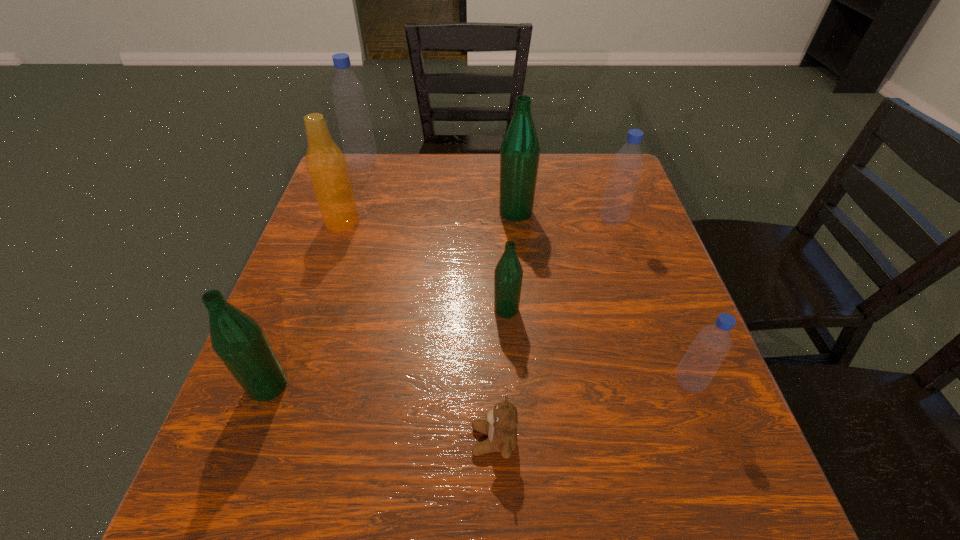
Where is `the nearest object`? the nearest object is located at coordinates (501, 425).

The width and height of the screenshot is (960, 540). What are the coordinates of `the shortest object` in the screenshot? It's located at (501, 425).

The image size is (960, 540). In order to click on vacant region located 0.230m on the front of the biggest blue bottle in this screenshot , I will do `click(343, 221)`.

At what (x,y) coordinates should I click in order to perform the action: click on free space located on the left of the biggest green bottle. Please return your answer as a coordinate pair (x, y). Looking at the image, I should click on (474, 212).

The image size is (960, 540). I want to click on vacant space located 0.310m on the right of the beer bottle, so click(x=484, y=222).

Identify the location of vacant space located 0.230m on the front of the second biggest blue bottle. (639, 300).

Locate an element on the screen. This screenshot has width=960, height=540. free space located on the right of the second biggest green bottle is located at coordinates pyautogui.click(x=468, y=386).

The width and height of the screenshot is (960, 540). Find the location of `vacant space located 0.100m on the back of the smallest green bottle`. vacant space located 0.100m on the back of the smallest green bottle is located at coordinates (504, 266).

The width and height of the screenshot is (960, 540). What are the coordinates of `vacant space located 0.370m on the left of the smallest blue bottle` in the screenshot? It's located at (467, 382).

Where is `free space located 0.320m on the front-facing side of the shortest object`? The image size is (960, 540). free space located 0.320m on the front-facing side of the shortest object is located at coordinates (275, 440).